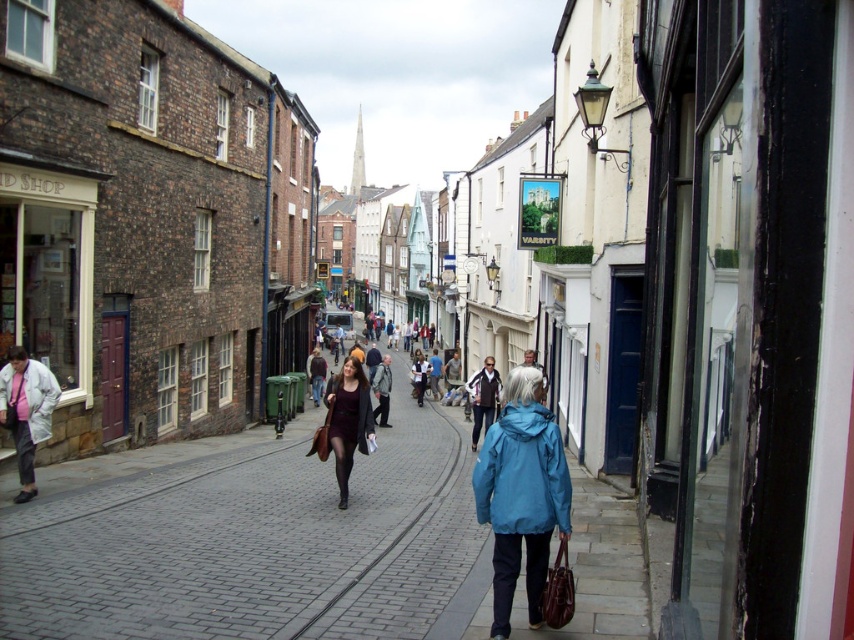
You are a delivery person carrying a box and need to walk through the narrow street. You see the gray brick pavement at center and the matte brown jacket at center. Which object should you avoid stepping on to stay on the correct path?

You should avoid stepping on the matte brown jacket at center because the gray brick pavement at center is positioned on its left side, indicating the jacket is on the path and the pavement is the correct surface to walk on.

You are a delivery person carrying a large box that is 2 meters wide. You need to walk through the street shown in the image. Considering the gray brick pavement at center and the teal matte jacket at center, which path should you choose to ensure your box fits through?

The gray brick pavement at center is wider than the teal matte jacket at center. Therefore, you should choose the path along the gray brick pavement at center to accommodate the 2 meter wide box.